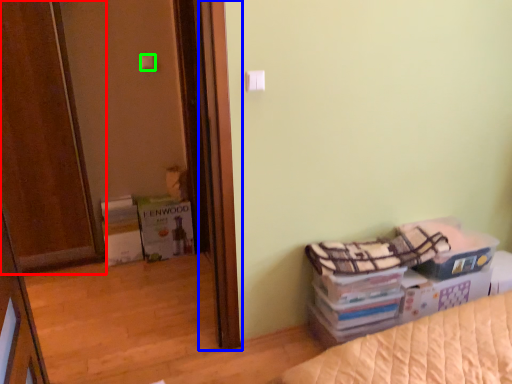
Question: Which object is positioned farthest from door (highlighted by a red box)? Select from screen door (highlighted by a blue box) and light switch (highlighted by a green box).

Choices:
 (A) screen door
 (B) light switch

Answer: (A)